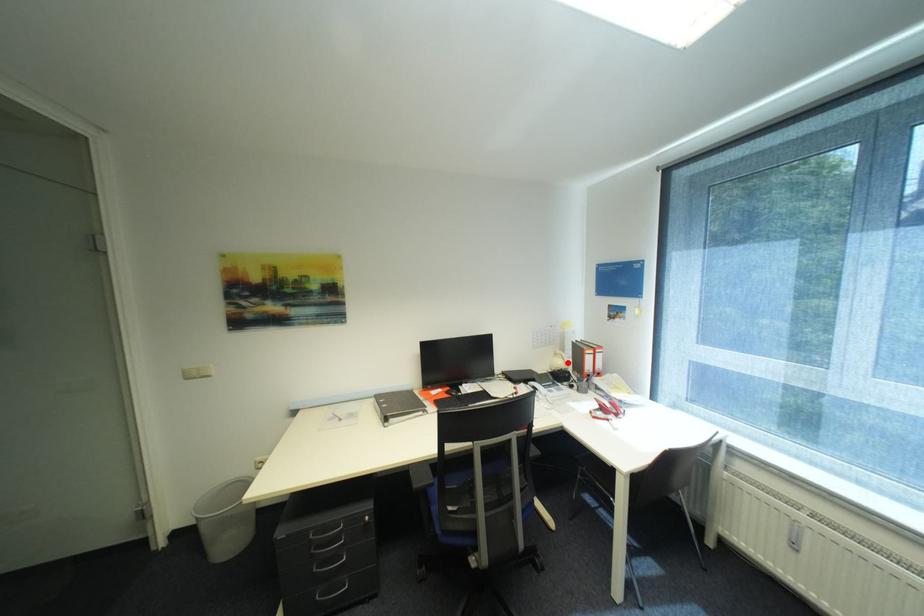
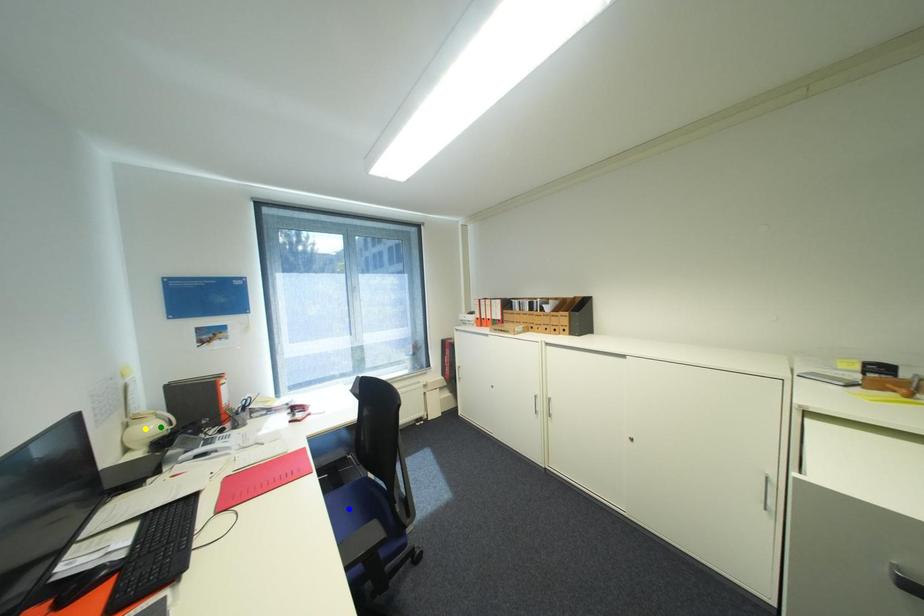
Question: I am providing you with two images of the same scene from different viewpoints. A red point is marked on the first image. You are given multiple points on the second image. Which mark in image 2 goes with the point in image 1?

Choices:
 (A) blue point
 (B) yellow point
 (C) green point

Answer: (C)